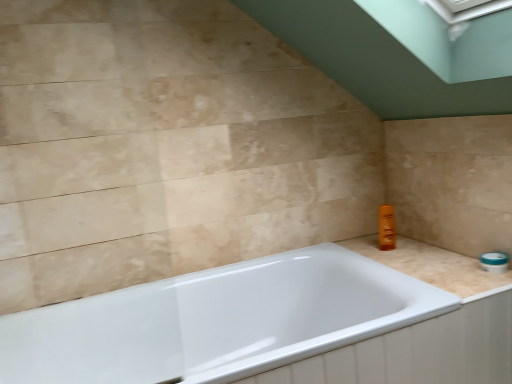
Question: Can you confirm if beige marble counter top at right is smaller than white glossy bathtub at center?

Choices:
 (A) yes
 (B) no

Answer: (A)

Question: Is beige marble counter top at right shorter than white glossy bathtub at center?

Choices:
 (A) no
 (B) yes

Answer: (B)

Question: Is beige marble counter top at right not near white glossy bathtub at center?

Choices:
 (A) yes
 (B) no

Answer: (B)

Question: Is beige marble counter top at right facing away from white glossy bathtub at center?

Choices:
 (A) no
 (B) yes

Answer: (A)

Question: Considering the relative positions of beige marble counter top at right and white glossy bathtub at center in the image provided, is beige marble counter top at right behind white glossy bathtub at center?

Choices:
 (A) no
 (B) yes

Answer: (B)

Question: Can you confirm if beige marble counter top at right is positioned to the right of white glossy bathtub at center?

Choices:
 (A) no
 (B) yes

Answer: (B)

Question: Is white glossy bathtub at center not inside beige marble counter top at right?

Choices:
 (A) yes
 (B) no

Answer: (A)

Question: Considering the relative positions of white glossy bathtub at center and beige marble counter top at right in the image provided, is white glossy bathtub at center to the right of beige marble counter top at right from the viewer's perspective?

Choices:
 (A) no
 (B) yes

Answer: (A)

Question: Is white glossy bathtub at center turned away from beige marble counter top at right?

Choices:
 (A) yes
 (B) no

Answer: (B)

Question: Does white glossy bathtub at center lie in front of beige marble counter top at right?

Choices:
 (A) no
 (B) yes

Answer: (B)

Question: Considering the relative positions of white glossy bathtub at center and beige marble counter top at right in the image provided, is white glossy bathtub at center behind beige marble counter top at right?

Choices:
 (A) no
 (B) yes

Answer: (A)

Question: Could you tell me if white glossy bathtub at center is turned towards beige marble counter top at right?

Choices:
 (A) yes
 (B) no

Answer: (B)

Question: Considering the positions of beige marble counter top at right and white glossy bathtub at center in the image, is beige marble counter top at right wider or thinner than white glossy bathtub at center?

Choices:
 (A) thin
 (B) wide

Answer: (A)